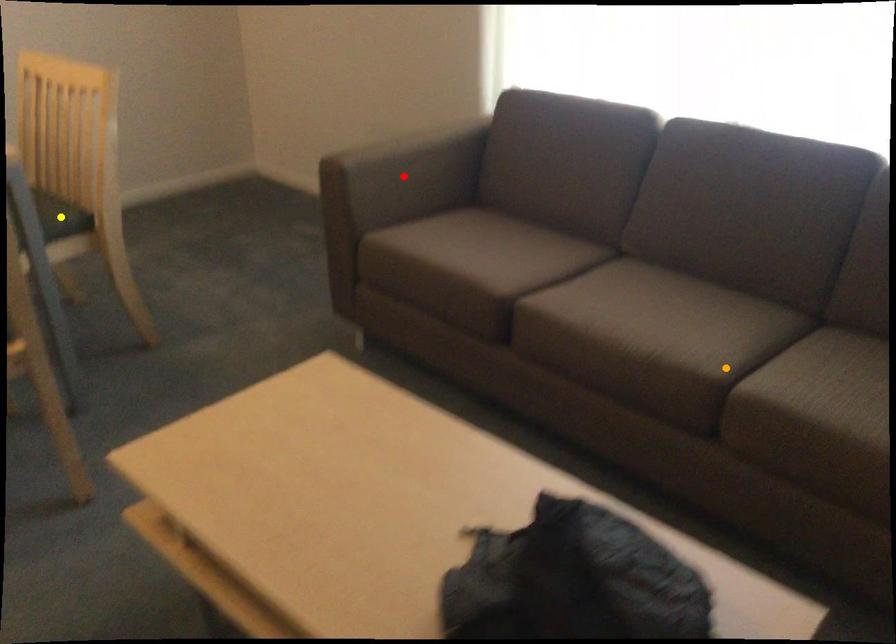
Order these from nearest to farthest:
1. red point
2. yellow point
3. orange point

orange point, yellow point, red point